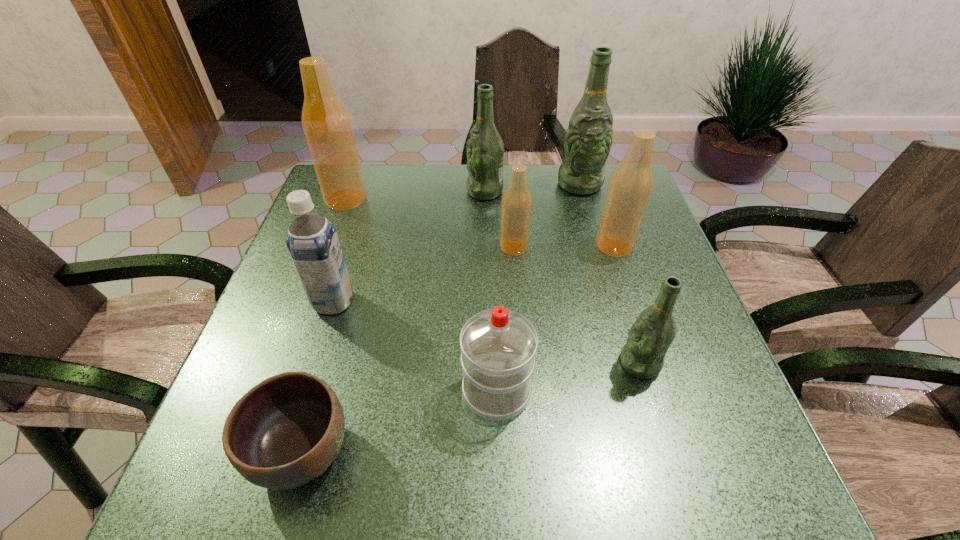
The image size is (960, 540). Find the location of `vacant point located on the surface of the nearest green beer bottle`. vacant point located on the surface of the nearest green beer bottle is located at coordinates (449, 363).

This screenshot has width=960, height=540. I want to click on free space located 0.400m on the surface of the nearest green beer bottle, so click(414, 363).

The height and width of the screenshot is (540, 960). Find the location of `free location located on the handle side of the water bottle`. free location located on the handle side of the water bottle is located at coordinates (492, 232).

Where is `vacant space situated on the handle side of the water bottle`? vacant space situated on the handle side of the water bottle is located at coordinates (493, 279).

Find the location of a particular element. free space located 0.180m on the handle side of the water bottle is located at coordinates (493, 294).

At what (x,y) coordinates should I click in order to perform the action: click on blank area located 0.090m on the right of the bowl. Please return your answer as a coordinate pair (x, y). This screenshot has width=960, height=540. Looking at the image, I should click on pyautogui.click(x=406, y=451).

You are a GUI agent. You are given a task and a screenshot of the screen. Output one action in this format:
    pyautogui.click(x=<x>, y=<y>)
    Task: Click on the object at the near edge
    
    Given the screenshot: What is the action you would take?
    pyautogui.click(x=284, y=432)

The image size is (960, 540). I want to click on beer bottle that is at the left edge, so click(x=326, y=123).

This screenshot has height=540, width=960. In order to click on soya milk present at the left edge in this screenshot , I will do `click(312, 241)`.

Locate an element on the screen. bowl present at the left edge is located at coordinates (284, 432).